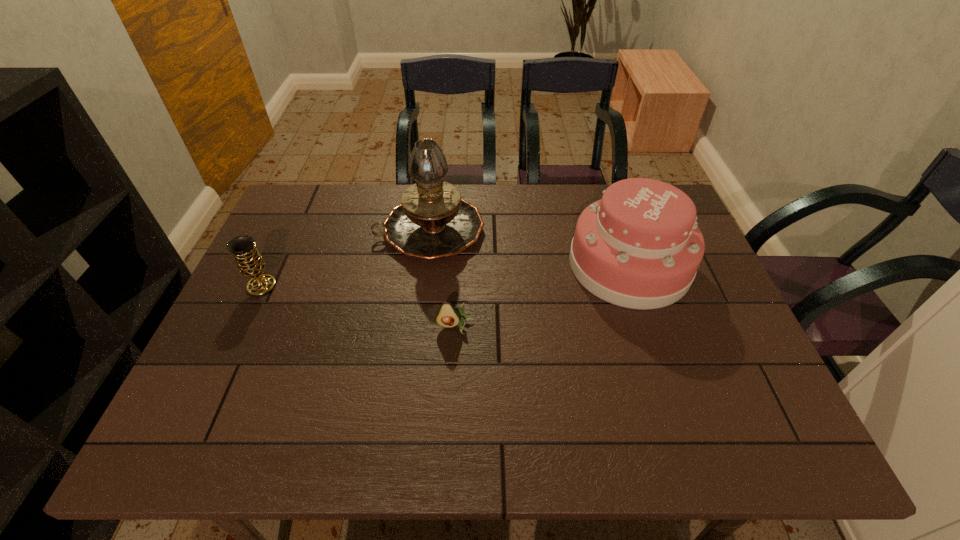
Find the location of a particular element. The height and width of the screenshot is (540, 960). free location located 0.280m on the seed side of the nearest object is located at coordinates (449, 449).

Identify the location of oil lamp located in the far edge section of the desktop. The width and height of the screenshot is (960, 540). (433, 221).

Find the location of a particular element. This screenshot has height=540, width=960. birthday cake that is at the far edge is located at coordinates (639, 247).

Identify the location of object present at the left edge. (243, 248).

At what (x,y) coordinates should I click in order to perform the action: click on object at the right edge. Please return your answer as a coordinate pair (x, y). Looking at the image, I should click on (x=639, y=247).

Where is `object that is at the far right corner`? The height and width of the screenshot is (540, 960). object that is at the far right corner is located at coordinates coord(639,247).

Image resolution: width=960 pixels, height=540 pixels. Find the location of `free space at the far edge of the desktop`. free space at the far edge of the desktop is located at coordinates (364, 230).

This screenshot has width=960, height=540. In order to click on free spot at the near edge of the desktop in this screenshot , I will do `click(316, 429)`.

Locate an element on the screen. Image resolution: width=960 pixels, height=540 pixels. vacant space at the left edge is located at coordinates (272, 263).

Image resolution: width=960 pixels, height=540 pixels. I want to click on vacant area at the far left corner of the desktop, so click(x=300, y=199).